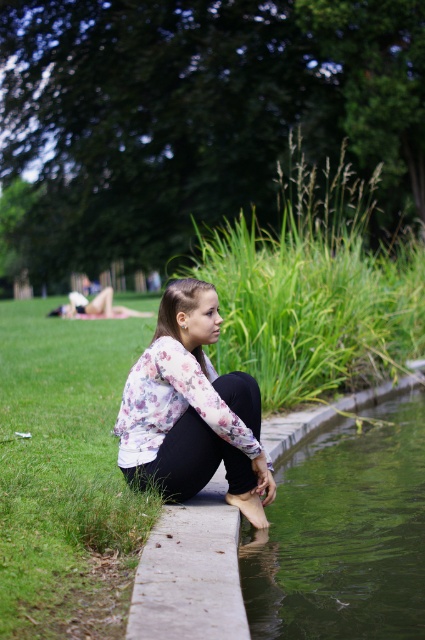
Question: Among these points, which one is farthest from the camera?

Choices:
 (A) (376, 412)
 (B) (170, 442)

Answer: (A)

Question: Is green smooth water at lower center in front of white fabric blanket at upper left?

Choices:
 (A) yes
 (B) no

Answer: (A)

Question: Estimate the real-world distances between objects in this image. Which object is farther from the green smooth water at lower center?

Choices:
 (A) floral fabric shirt at center
 (B) white fabric blanket at upper left

Answer: (B)

Question: Is green smooth water at lower center below floral fabric shirt at center?

Choices:
 (A) yes
 (B) no

Answer: (A)

Question: Does floral fabric shirt at center come behind white fabric blanket at upper left?

Choices:
 (A) yes
 (B) no

Answer: (B)

Question: Which point is closer to the camera?

Choices:
 (A) floral fabric shirt at center
 (B) white fabric blanket at upper left
 (C) green smooth water at lower center

Answer: (C)